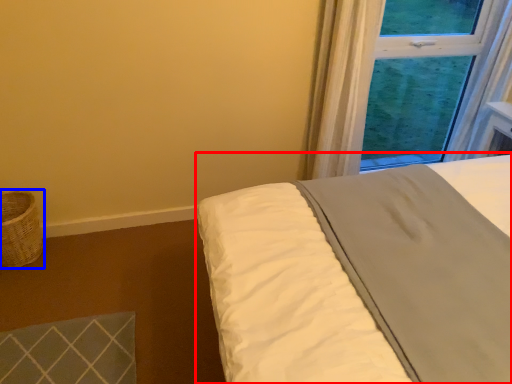
Question: Which object appears closest to the camera in this image, bed (highlighted by a red box) or basket (highlighted by a blue box)?

Choices:
 (A) bed
 (B) basket

Answer: (A)